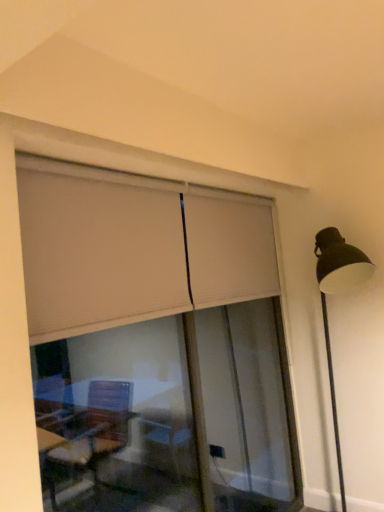
The width and height of the screenshot is (384, 512). Find the location of `white matte window frame at upper center`. white matte window frame at upper center is located at coordinates (23, 280).

Image resolution: width=384 pixels, height=512 pixels. I want to click on beige fabric curtain at upper center, so click(x=133, y=248).

Identify the location of white matte window frame at upper center. (23, 280).

Can you confirm if white matte window frame at upper center is positioned to the left of beige fabric curtain at upper center?

No.

Is white matte window frame at upper center not near beige fabric curtain at upper center?

No, white matte window frame at upper center is not far away from beige fabric curtain at upper center.

Who is bigger, white matte window frame at upper center or beige fabric curtain at upper center?

white matte window frame at upper center.

Could you tell me if white matte window frame at upper center is turned towards beige fabric curtain at upper center?

Yes, white matte window frame at upper center is oriented towards beige fabric curtain at upper center.

Does beige fabric curtain at upper center have a greater height compared to matte black lamp post at right?

Incorrect, the height of beige fabric curtain at upper center is not larger of that of matte black lamp post at right.

What are the coordinates of `lamp post behind the beige fabric curtain at upper center` in the screenshot? It's located at (335, 293).

From a real-world perspective, who is located lower, beige fabric curtain at upper center or matte black lamp post at right?

matte black lamp post at right.

Is beige fabric curtain at upper center aimed at matte black lamp post at right?

No, beige fabric curtain at upper center does not turn towards matte black lamp post at right.

Is point (358, 250) positioned after point (48, 322)?

That is True.

You are a GUI agent. You are given a task and a screenshot of the screen. Output one action in this format:
    pyautogui.click(x=<x>, y=<y>)
    Task: Click on the curtain in front of the matte black lamp post at right
    
    Given the screenshot: What is the action you would take?
    pyautogui.click(x=133, y=248)

Looking at this image, is matte black lamp post at right turned away from beige fabric curtain at upper center?

No, matte black lamp post at right is not facing away from beige fabric curtain at upper center.

Is matte black lamp post at right touching beige fabric curtain at upper center?

matte black lamp post at right and beige fabric curtain at upper center are clearly separated.

Which is nearer, (234, 298) or (16, 406)?

Point (234, 298) is positioned farther from the camera compared to point (16, 406).

Is beige fabric curtain at upper center wider than white matte window frame at upper center?

Yes, beige fabric curtain at upper center is wider than white matte window frame at upper center.

Is beige fabric curtain at upper center turned away from white matte window frame at upper center?

Yes.

I want to click on curtain above the white matte window frame at upper center (from the image's perspective), so click(x=133, y=248).

From a real-world perspective, is white matte window frame at upper center on top of matte black lamp post at right?

Correct, in the physical world, white matte window frame at upper center is higher than matte black lamp post at right.

Choose the correct answer: Is white matte window frame at upper center inside matte black lamp post at right or outside it?

white matte window frame at upper center is not enclosed by matte black lamp post at right.

Considering the sizes of objects white matte window frame at upper center and matte black lamp post at right in the image provided, who is wider, white matte window frame at upper center or matte black lamp post at right?

matte black lamp post at right is wider.

Considering the positions of objects white matte window frame at upper center and matte black lamp post at right in the image provided, who is more to the left, white matte window frame at upper center or matte black lamp post at right?

white matte window frame at upper center.

Is matte black lamp post at right bigger than white matte window frame at upper center?

Yes.

Would you say white matte window frame at upper center is part of matte black lamp post at right's contents?

No, white matte window frame at upper center is not surrounded by matte black lamp post at right.

From a real-world perspective, who is located higher, matte black lamp post at right or white matte window frame at upper center?

In real-world perspective, white matte window frame at upper center is above.

Which object is thinner, matte black lamp post at right or white matte window frame at upper center?

white matte window frame at upper center is thinner.

This screenshot has height=512, width=384. What are the coordinates of `curtain above the white matte window frame at upper center (from the image's perspective)` in the screenshot? It's located at (133, 248).

At what (x,y) coordinates should I click in order to perform the action: click on lamp post below the beige fabric curtain at upper center (from the image's perspective). Please return your answer as a coordinate pair (x, y). Image resolution: width=384 pixels, height=512 pixels. Looking at the image, I should click on (335, 293).

Looking at the image, which one is located closer to beige fabric curtain at upper center, matte black lamp post at right or white matte window frame at upper center?

Answer: Based on the image, white matte window frame at upper center appears to be nearer to beige fabric curtain at upper center.

Looking at the image, which one is located closer to matte black lamp post at right, white matte window frame at upper center or beige fabric curtain at upper center?

The object closer to matte black lamp post at right is white matte window frame at upper center.

From the image, which object appears to be nearer to white matte window frame at upper center, beige fabric curtain at upper center or matte black lamp post at right?

beige fabric curtain at upper center is closer to white matte window frame at upper center.

Estimate the real-world distances between objects in this image. Which object is further from beige fabric curtain at upper center, white matte window frame at upper center or matte black lamp post at right?

matte black lamp post at right is positioned further to the anchor beige fabric curtain at upper center.

When comparing their distances from matte black lamp post at right, does beige fabric curtain at upper center or white matte window frame at upper center seem closer?

Among the two, white matte window frame at upper center is located nearer to matte black lamp post at right.

Estimate the real-world distances between objects in this image. Which object is closer to white matte window frame at upper center, matte black lamp post at right or beige fabric curtain at upper center?

The object closer to white matte window frame at upper center is beige fabric curtain at upper center.

Image resolution: width=384 pixels, height=512 pixels. Identify the location of window frame situated between beige fabric curtain at upper center and matte black lamp post at right from left to right. (23, 280).